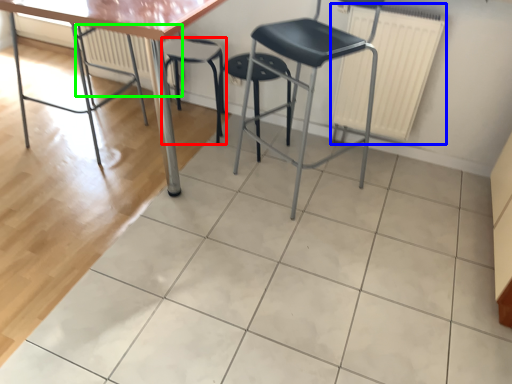
Question: Which object is the farthest from stool (highlighted by a red box)? Choose among these: radiator (highlighted by a blue box) or radiator (highlighted by a green box).

Choices:
 (A) radiator
 (B) radiator

Answer: (A)